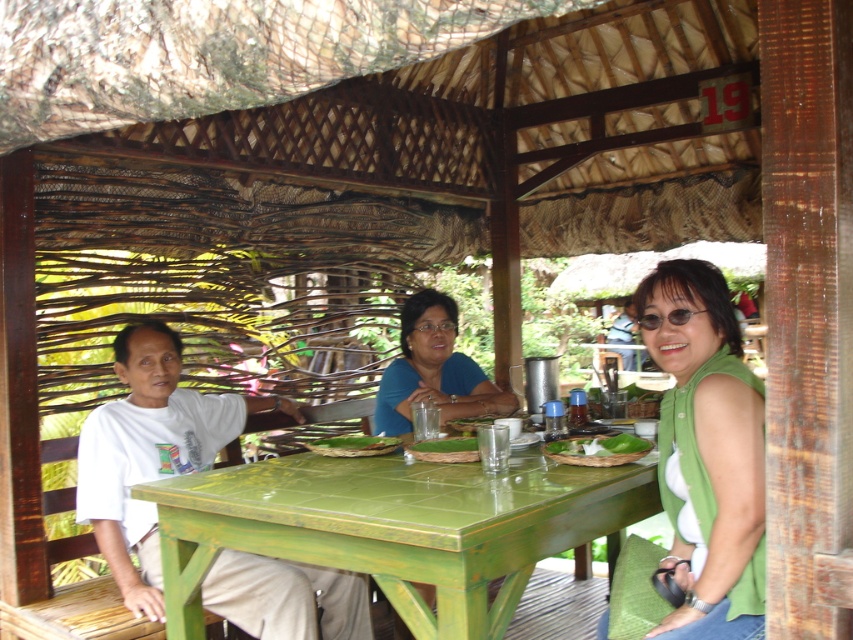
Between blue matte shirt at center and green woven mat at table, which one has less height?

green woven mat at table is shorter.

Is blue matte shirt at center taller than green woven mat at table?

Yes, blue matte shirt at center is taller than green woven mat at table.

What do you see at coordinates (433, 369) in the screenshot? I see `blue matte shirt at center` at bounding box center [433, 369].

The height and width of the screenshot is (640, 853). I want to click on blue matte shirt at center, so click(433, 369).

Is green sleeveless shirt at center smaller than green woven mat at table?

Actually, green sleeveless shirt at center might be larger than green woven mat at table.

Which of these two, green sleeveless shirt at center or green woven mat at table, stands taller?

With more height is green sleeveless shirt at center.

Where is `green sleeveless shirt at center`? The width and height of the screenshot is (853, 640). green sleeveless shirt at center is located at coordinates (706, 452).

Does green leafy vegetable at table have a larger size compared to green leafy vegetable at table center?

Yes, green leafy vegetable at table is bigger than green leafy vegetable at table center.

Is green leafy vegetable at table taller than green leafy vegetable at table center?

Indeed, green leafy vegetable at table has a greater height compared to green leafy vegetable at table center.

The height and width of the screenshot is (640, 853). What do you see at coordinates (598, 449) in the screenshot?
I see `green leafy vegetable at table` at bounding box center [598, 449].

You are a GUI agent. You are given a task and a screenshot of the screen. Output one action in this format:
    pyautogui.click(x=<x>, y=<y>)
    Task: Click on the green leafy vegetable at table
    This screenshot has height=640, width=853.
    Given the screenshot: What is the action you would take?
    pyautogui.click(x=598, y=449)